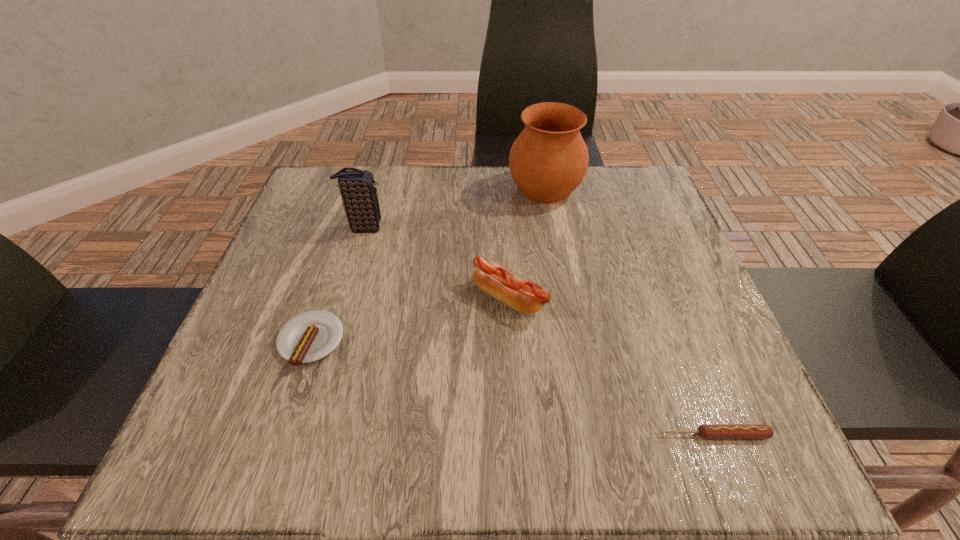
The image size is (960, 540). I want to click on the farthest object, so click(x=549, y=159).

Identify the location of pottery. (549, 159).

Locate an element on the screen. This screenshot has width=960, height=540. the second farthest object is located at coordinates (357, 187).

You are a GUI agent. You are given a task and a screenshot of the screen. Output one action in this format:
    pyautogui.click(x=<x>, y=<y>)
    Task: Click on the clutch bag
    
    Given the screenshot: What is the action you would take?
    [x=357, y=187]

This screenshot has width=960, height=540. Identify the location of the third shortest object. (521, 294).

I want to click on the second sausage from right to left, so click(x=521, y=294).

Locate an element on the screen. This screenshot has height=540, width=960. the second tallest sausage is located at coordinates (310, 336).

Locate an element on the screen. the second shortest object is located at coordinates (310, 336).

At what (x,y) coordinates should I click in order to perform the action: click on the rightmost sausage. Please return your answer as a coordinate pair (x, y). The height and width of the screenshot is (540, 960). Looking at the image, I should click on (707, 431).

Locate an element on the screen. the shortest object is located at coordinates (707, 431).